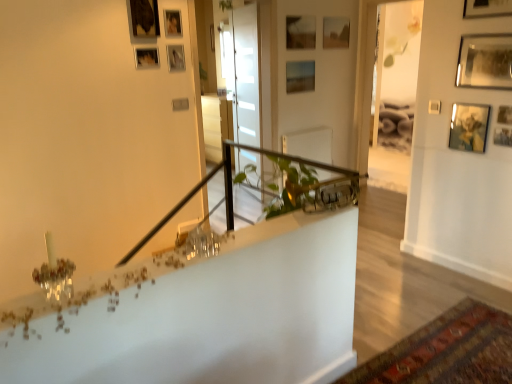
Question: Is wooden picture frame at upper center, which ranks as the 1th picture frame in left-to-right order, beside carpeted mat at lower right?

Choices:
 (A) no
 (B) yes

Answer: (A)

Question: Does wooden picture frame at upper center, which ranks as the 1th picture frame in left-to-right order, have a larger size compared to carpeted mat at lower right?

Choices:
 (A) no
 (B) yes

Answer: (A)

Question: Does wooden picture frame at upper center, the sixth picture frame viewed from the front, contain carpeted mat at lower right?

Choices:
 (A) yes
 (B) no

Answer: (B)

Question: Is the position of wooden picture frame at upper center, the sixth picture frame viewed from the front, more distant than that of carpeted mat at lower right?

Choices:
 (A) no
 (B) yes

Answer: (B)

Question: Is wooden picture frame at upper center, the sixth picture frame viewed from the front, aimed at carpeted mat at lower right?

Choices:
 (A) no
 (B) yes

Answer: (A)

Question: Are wooden picture frame at upper center, acting as the eleventh picture frame starting from the right, and carpeted mat at lower right far apart?

Choices:
 (A) yes
 (B) no

Answer: (A)

Question: Is metallic gold picture frame at upper right, positioned as the 8th picture frame in back-to-front order, smaller than matte wooden picture frame at upper center, the fifth picture frame in the right-to-left sequence?

Choices:
 (A) no
 (B) yes

Answer: (B)

Question: From a real-world perspective, is metallic gold picture frame at upper right, the 9th picture frame from the left, below matte wooden picture frame at upper center, the eleventh picture frame viewed from the front?

Choices:
 (A) no
 (B) yes

Answer: (B)

Question: Is metallic gold picture frame at upper right, positioned as the 8th picture frame in back-to-front order, aimed at matte wooden picture frame at upper center, arranged as the 1th picture frame when viewed from the back?

Choices:
 (A) yes
 (B) no

Answer: (B)

Question: Is metallic gold picture frame at upper right, marked as the 4th picture frame in a front-to-back arrangement, further to the viewer compared to matte wooden picture frame at upper center, arranged as the 1th picture frame when viewed from the back?

Choices:
 (A) yes
 (B) no

Answer: (B)

Question: Considering the relative positions of metallic gold picture frame at upper right, marked as the 4th picture frame in a front-to-back arrangement, and matte wooden picture frame at upper center, the fifth picture frame in the right-to-left sequence, in the image provided, is metallic gold picture frame at upper right, marked as the 4th picture frame in a front-to-back arrangement, in front of matte wooden picture frame at upper center, the fifth picture frame in the right-to-left sequence,?

Choices:
 (A) no
 (B) yes

Answer: (B)

Question: Is matte wooden picture frame at upper center, the fifth picture frame in the right-to-left sequence, surrounded by metallic gold picture frame at upper right, positioned as the 8th picture frame in back-to-front order?

Choices:
 (A) yes
 (B) no

Answer: (B)

Question: Can you confirm if wooden picture frame at upper right, the 3th picture frame from the front, is wider than wooden picture frame at upper center, the fifth picture frame from the left?

Choices:
 (A) yes
 (B) no

Answer: (B)